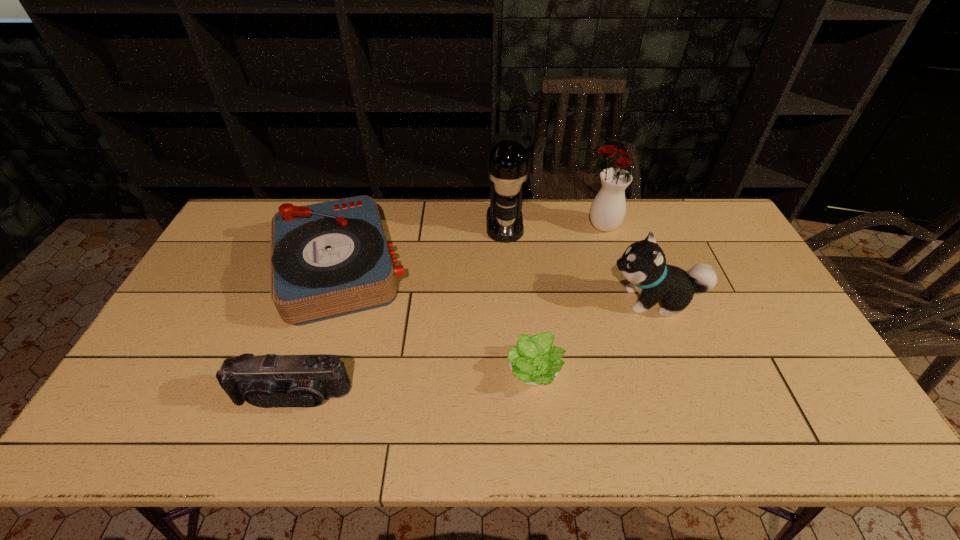
Locate an element on the screen. The height and width of the screenshot is (540, 960). free space between the coffee maker and the record player is located at coordinates (422, 246).

Where is `the closest object to the record player`? the closest object to the record player is located at coordinates (266, 381).

Find the location of a particular element. object that is the fifth closest to the record player is located at coordinates (643, 263).

The width and height of the screenshot is (960, 540). In order to click on vacant position in the image that satisfies the following two spatial constraints: 1. on the back side of the lettuce; 2. on the right side of the vase in this screenshot , I will do `click(519, 227)`.

Find the location of `vacant region that satisfies the following two spatial constraints: 1. on the front side of the shortest object; 2. on the left side of the record player`. vacant region that satisfies the following two spatial constraints: 1. on the front side of the shortest object; 2. on the left side of the record player is located at coordinates (306, 373).

Where is `free space that satisfies the following two spatial constraints: 1. at the face of the third tallest object; 2. on the front-facing side of the camcorder`? The height and width of the screenshot is (540, 960). free space that satisfies the following two spatial constraints: 1. at the face of the third tallest object; 2. on the front-facing side of the camcorder is located at coordinates (691, 395).